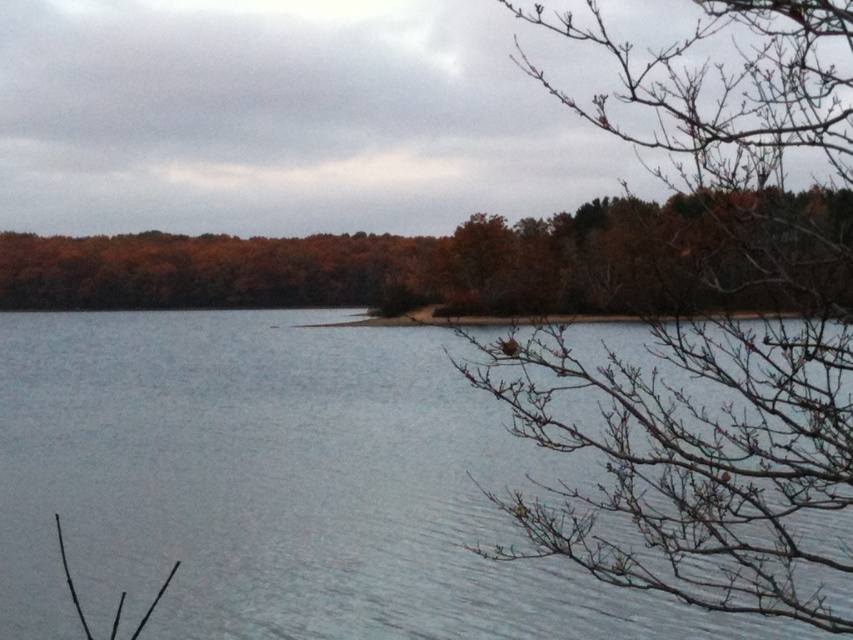
You are an environmental scientist assessing the lake health. You observe the clear water at center and the brown matte tree at center. Which object occupies a larger area in the scene?

The brown matte tree at center occupies a larger area in the scene compared to the clear water at center, as stated in the description.